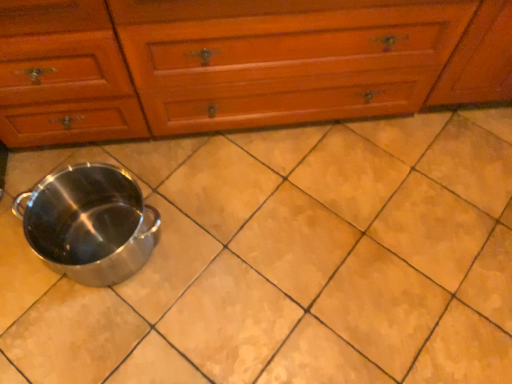
Image resolution: width=512 pixels, height=384 pixels. I want to click on free space to the left of satin silver crock pot at lower left, so click(x=17, y=239).